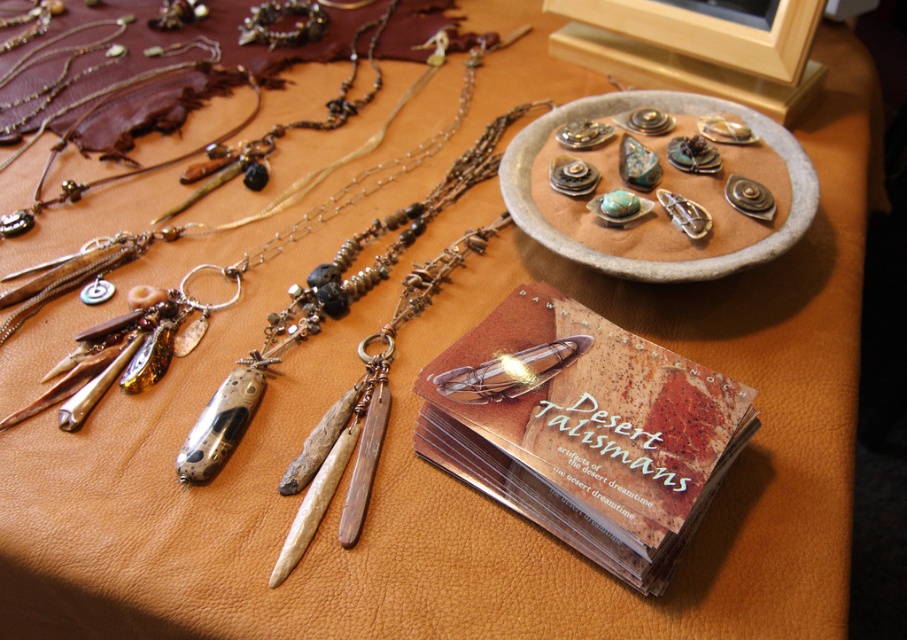
Is translucent plastic cards at center shorter than metallic stone pendants at center?

Incorrect, translucent plastic cards at center's height does not fall short of metallic stone pendants at center's.

Is translucent plastic cards at center taller than metallic stone pendants at center?

Yes.

Measure the distance between translucent plastic cards at center and camera.

translucent plastic cards at center and camera are 32.07 inches apart from each other.

What are the coordinates of `translucent plastic cards at center` in the screenshot? It's located at (584, 429).

Does translucent plastic cards at center have a smaller size compared to matte silver pendant at center?

Yes, translucent plastic cards at center is smaller than matte silver pendant at center.

The width and height of the screenshot is (907, 640). I want to click on translucent plastic cards at center, so click(584, 429).

Which of these two, matte silver pendant at center or metallic stone pendants at center, stands taller?

With more height is matte silver pendant at center.

Does point (342, 285) lie in front of point (616, 134)?

Yes, it is.

What do you see at coordinates (410, 225) in the screenshot? I see `matte silver pendant at center` at bounding box center [410, 225].

Find the location of a particular element. matte silver pendant at center is located at coordinates (410, 225).